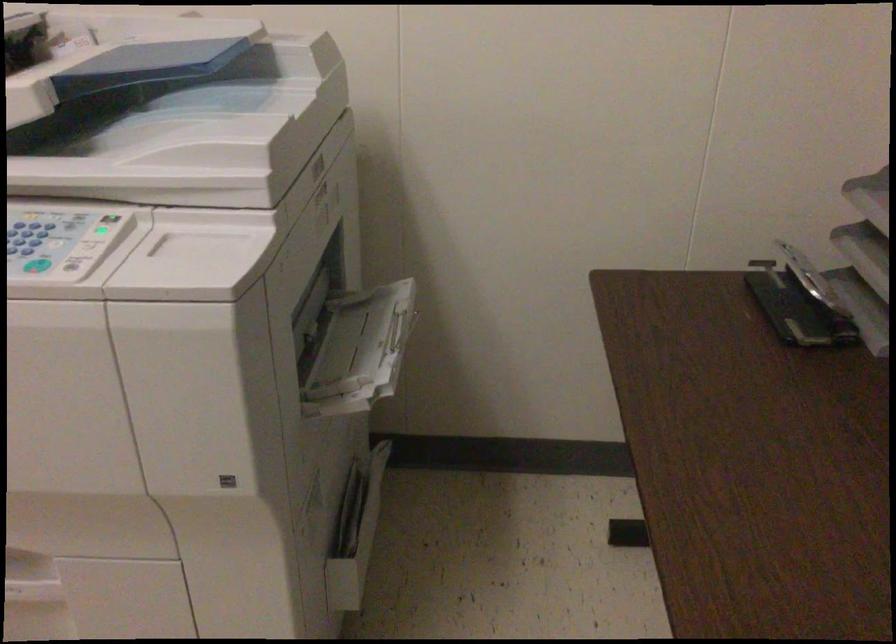
What do you see at coordinates (173, 126) in the screenshot? Image resolution: width=896 pixels, height=644 pixels. I see `a printer scanner lid` at bounding box center [173, 126].